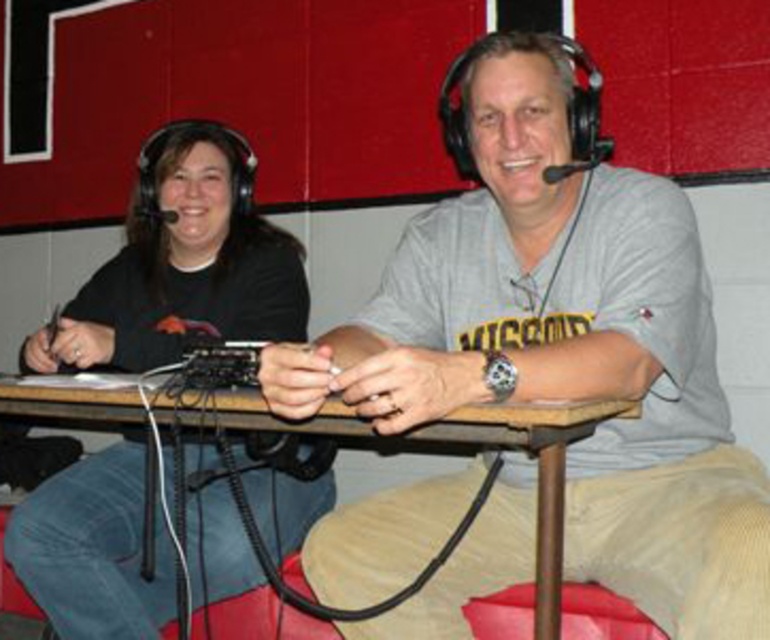
Question: Can you confirm if black matte headphones at left is positioned to the left of wooden table at center?

Choices:
 (A) no
 (B) yes

Answer: (B)

Question: Is black matte headphones at left to the right of wooden table at center from the viewer's perspective?

Choices:
 (A) no
 (B) yes

Answer: (A)

Question: Which point is closer to the camera?

Choices:
 (A) (320, 410)
 (B) (163, 307)

Answer: (A)

Question: Can you confirm if black matte headphones at left is positioned to the right of wooden table at center?

Choices:
 (A) no
 (B) yes

Answer: (A)